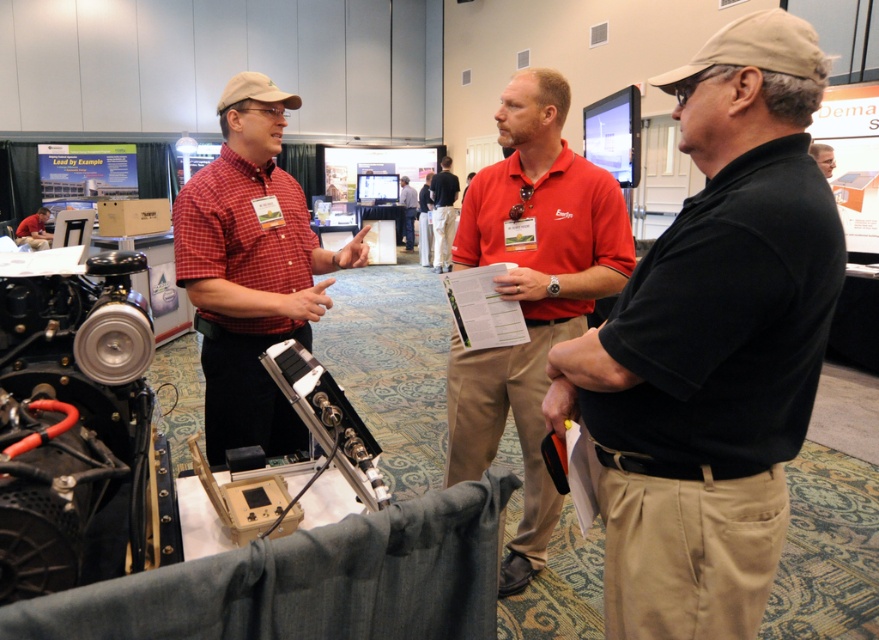
Question: Which point is farther to the camera?

Choices:
 (A) (423, 260)
 (B) (258, 412)

Answer: (A)

Question: Which object is farther from the camera taking this photo?

Choices:
 (A) light brown leather jacket at upper right
 (B) black matte shirt at center
 (C) matte red shirt at center

Answer: (A)

Question: Is dark blue shirt at center thinner than matte black shirt at center?

Choices:
 (A) yes
 (B) no

Answer: (A)

Question: Can you confirm if khaki pants at center is wider than light brown leather jacket at upper right?

Choices:
 (A) yes
 (B) no

Answer: (B)

Question: Which of the following is the farthest from the observer?

Choices:
 (A) matte red shirt at center
 (B) dark blue shirt at center
 (C) matte black shirt at center
 (D) red shirt at center

Answer: (D)

Question: Where is black matte shirt at center located in relation to khaki pants at center in the image?

Choices:
 (A) left
 (B) right

Answer: (B)